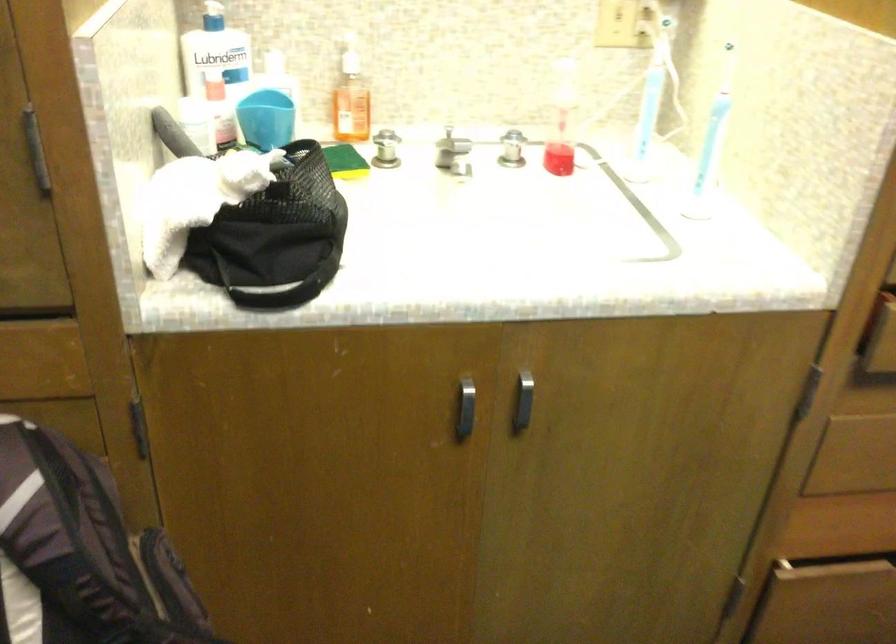
Image resolution: width=896 pixels, height=644 pixels. What do you see at coordinates (349, 59) in the screenshot?
I see `the soap dispenser pump` at bounding box center [349, 59].